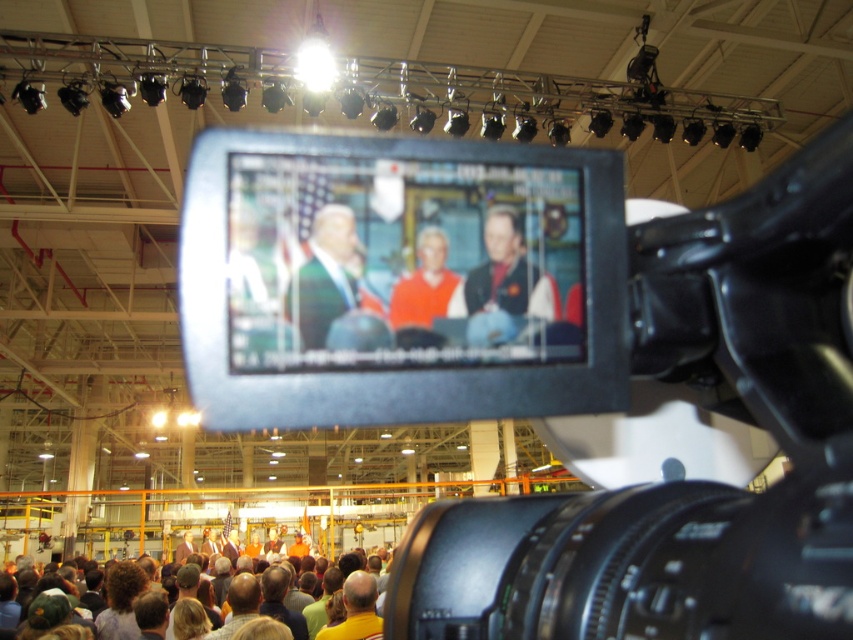
Question: Which of the following is the closest to the observer?

Choices:
 (A) (527, 276)
 (B) (328, 237)
 (C) (334, 234)

Answer: (B)

Question: Does matte plastic monitor at center appear under green fabric suit at center?

Choices:
 (A) yes
 (B) no

Answer: (B)

Question: Among these points, which one is nearest to the camera?

Choices:
 (A) (465, 288)
 (B) (421, 275)
 (C) (184, 595)

Answer: (B)

Question: Is dark brown hair at lower center above orange fabric sweater at center?

Choices:
 (A) yes
 (B) no

Answer: (B)

Question: Does matte plastic monitor at center have a smaller size compared to smooth blue shirt at center?

Choices:
 (A) no
 (B) yes

Answer: (A)

Question: Which is farther from the matte plastic monitor at center?

Choices:
 (A) smooth blue shirt at center
 (B) green fabric suit at center
 (C) dark brown hair at lower center

Answer: (C)